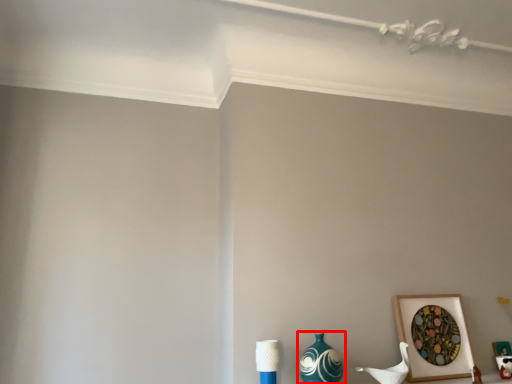
Question: From the image's perspective, where is vase (annotated by the red box) located in relation to picture frame in the image?

Choices:
 (A) above
 (B) below

Answer: (B)